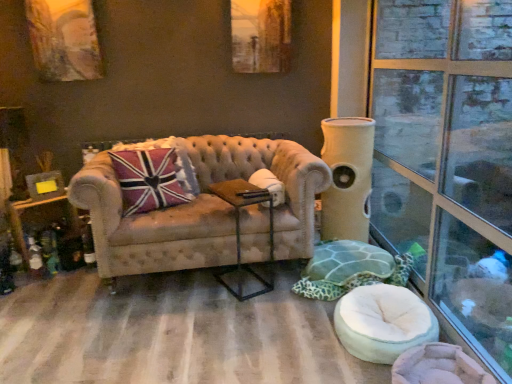
The height and width of the screenshot is (384, 512). Find the location of `free space on the front side of metallic brown side table at center`. free space on the front side of metallic brown side table at center is located at coordinates (242, 305).